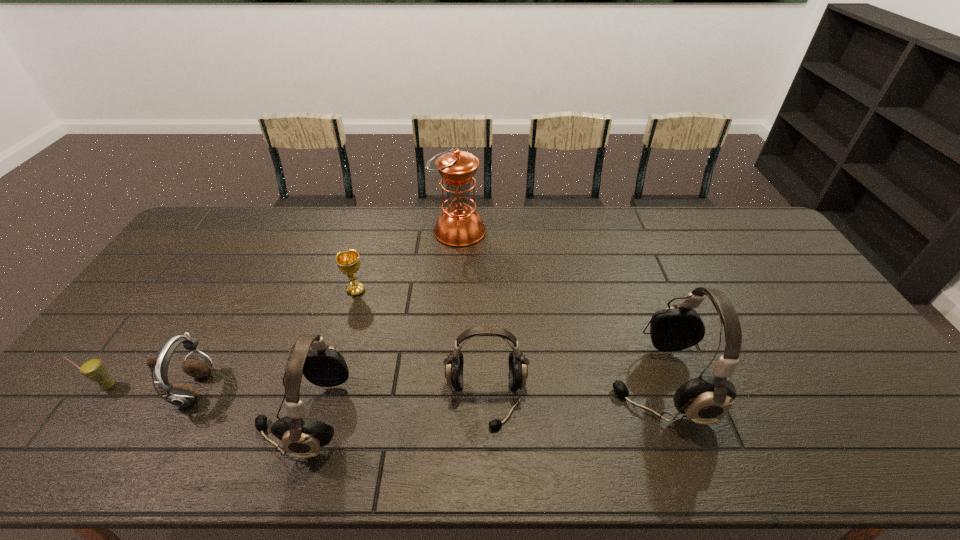
This screenshot has width=960, height=540. What are the coordinates of `earphone that is at the near edge` in the screenshot? It's located at (179, 394).

At what (x,y) coordinates should I click in order to perform the action: click on object at the left edge. Please return your answer as a coordinate pair (x, y). The height and width of the screenshot is (540, 960). Looking at the image, I should click on click(93, 369).

At what (x,y) coordinates should I click in order to perform the action: click on object present at the near left corner. Please return your answer as a coordinate pair (x, y). The height and width of the screenshot is (540, 960). Looking at the image, I should click on pos(93,369).

Find the location of a particular element. This screenshot has height=540, width=960. vacant point at the far edge is located at coordinates (578, 242).

Find the location of a particular element. This screenshot has height=540, width=960. vacant region at the near edge of the desktop is located at coordinates [x=150, y=414].

Locate an element on the screen. This screenshot has width=960, height=540. vacant space at the left edge of the desktop is located at coordinates (147, 311).

Locate an element on the screen. This screenshot has width=960, height=540. blank space at the far left corner of the desktop is located at coordinates (192, 238).

Image resolution: width=960 pixels, height=540 pixels. In the image, there is a desktop. In order to click on blank space at the far right corner in this screenshot , I will do `click(717, 211)`.

The image size is (960, 540). Find the location of `empty location between the second object from left to right and the straw for drinking`. empty location between the second object from left to right and the straw for drinking is located at coordinates (152, 388).

You are a GUI agent. You are given a task and a screenshot of the screen. Output one action in this format:
    pyautogui.click(x=<x>, y=<y>)
    Task: Click on the blank region between the leftmost object and the sixth nearest object
    
    Given the screenshot: What is the action you would take?
    pyautogui.click(x=232, y=338)